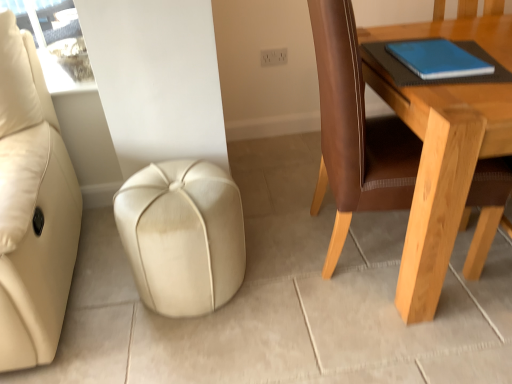
You are a GUI agent. You are given a task and a screenshot of the screen. Output one action in this format:
    pyautogui.click(x=<x>, y=<y>)
    Task: Click on the free space to the left of beige leather ottoman at center
    This screenshot has height=384, width=512.
    Given the screenshot: What is the action you would take?
    pyautogui.click(x=98, y=294)